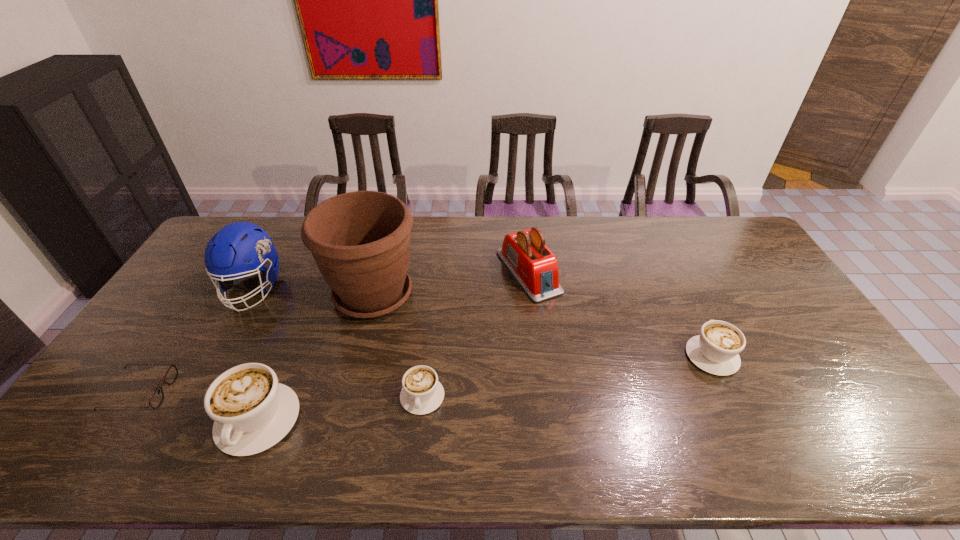
The width and height of the screenshot is (960, 540). Find the location of `the shortest object`. the shortest object is located at coordinates (156, 399).

Find the location of a particular element. This screenshot has width=960, height=540. free space located to the right of the second shortest cappuccino's handle is located at coordinates (683, 294).

Image resolution: width=960 pixels, height=540 pixels. I want to click on vacant area situated to the right of the second shortest cappuccino's handle, so tap(662, 253).

The height and width of the screenshot is (540, 960). I want to click on free space located to the right of the second shortest cappuccino's handle, so click(666, 262).

Locate an element on the screen. This screenshot has height=540, width=960. blank area located 0.390m on the right of the toaster is located at coordinates (674, 272).

Locate an element on the screen. This screenshot has height=540, width=960. free location located on the front-facing side of the sixth shortest object is located at coordinates (229, 329).

The width and height of the screenshot is (960, 540). I want to click on vacant space situated on the back of the flowerpot, so pos(387,242).

Identify the location of blank space located on the front-facing side of the sunglasses. Image resolution: width=960 pixels, height=540 pixels. (302, 392).

Locate an element on the screen. object that is at the far edge is located at coordinates (534, 266).

Where is `sunglasses present at the near edge`? The height and width of the screenshot is (540, 960). sunglasses present at the near edge is located at coordinates (156, 399).